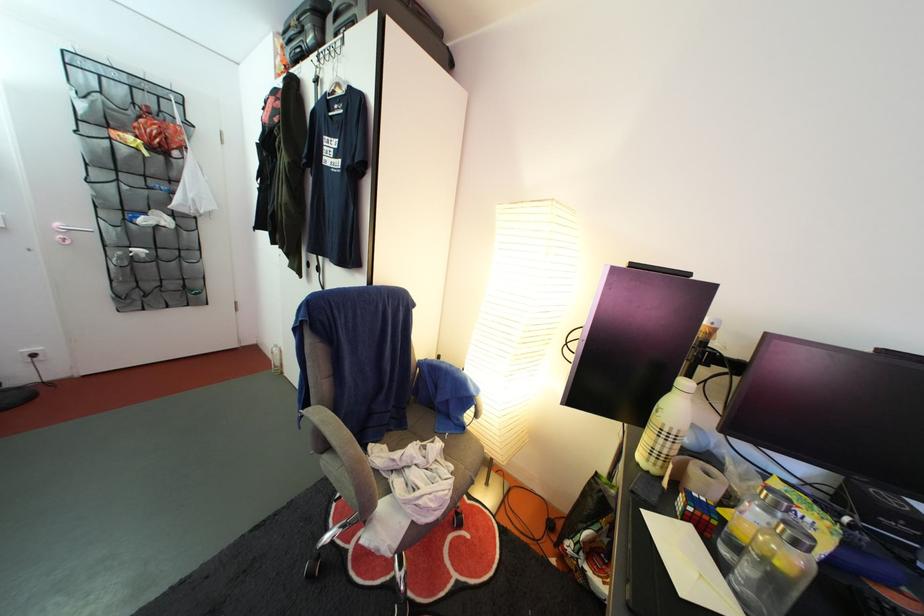
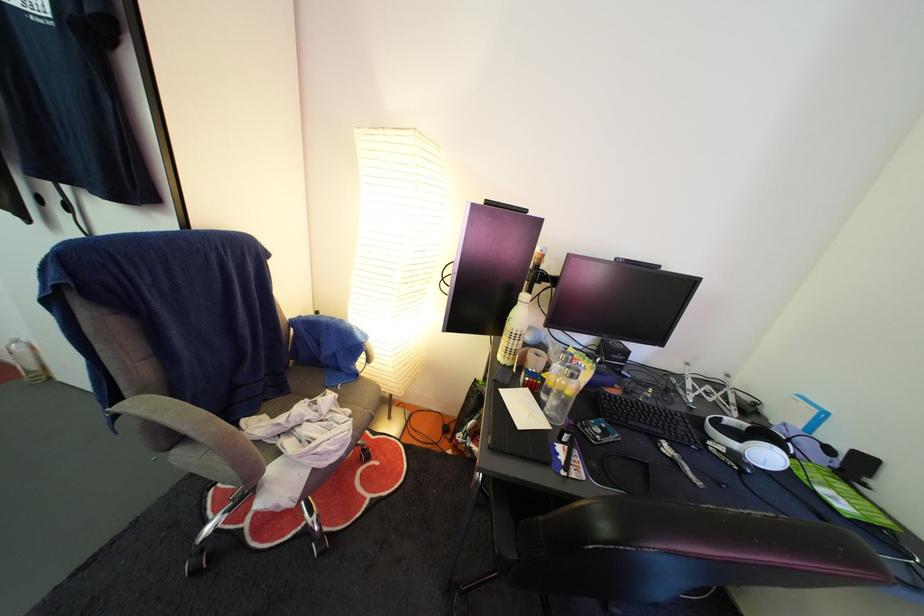
Find the pixel in the second image that matches [795,532] in the first image.

(578, 376)